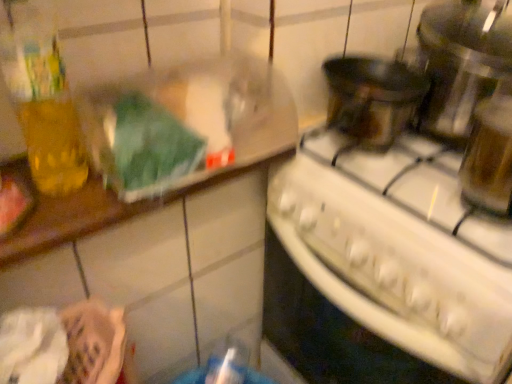
In order to face white glossy stove at center, should I rotate leftwards or rightwards?

You should rotate right by 19.127 degrees.

Measure the distance between white glossy stove at center and camera.

The depth of white glossy stove at center is 54.33 centimeters.

The image size is (512, 384). Describe the element at coordinates (383, 270) in the screenshot. I see `white glossy stove at center` at that location.

Locate an element on the screen. The image size is (512, 384). white glossy stove at center is located at coordinates (383, 270).

Identify the location of metallic silver pot at upper right. The image size is (512, 384). coord(460,64).

The width and height of the screenshot is (512, 384). What do you see at coordinates (460, 64) in the screenshot?
I see `metallic silver pot at upper right` at bounding box center [460, 64].

Where is `white glossy stove at center`? The image size is (512, 384). white glossy stove at center is located at coordinates (383, 270).

Considering the relative positions of white glossy stove at center and metallic silver pot at upper right in the image provided, is white glossy stove at center to the left of metallic silver pot at upper right from the viewer's perspective?

Yes, white glossy stove at center is to the left of metallic silver pot at upper right.

Considering the relative positions of white glossy stove at center and metallic silver pot at upper right in the image provided, is white glossy stove at center behind metallic silver pot at upper right?

No.

Does point (446, 312) come in front of point (466, 4)?

Yes, it is in front of point (466, 4).

In the scene shown: From the image's perspective, is white glossy stove at center on top of metallic silver pot at upper right?

No, from the image's perspective, white glossy stove at center is not on top of metallic silver pot at upper right.

From a real-world perspective, is white glossy stove at center under metallic silver pot at upper right?

Yes, from a real-world perspective, white glossy stove at center is below metallic silver pot at upper right.

Which object is thinner, white glossy stove at center or metallic silver pot at upper right?

With smaller width is metallic silver pot at upper right.

Based on the photo, is white glossy stove at center taller or shorter than metallic silver pot at upper right?

In the image, white glossy stove at center appears to be taller than metallic silver pot at upper right.

Is white glossy stove at center smaller than metallic silver pot at upper right?

No, white glossy stove at center is not smaller than metallic silver pot at upper right.

Is white glossy stove at center surrounding metallic silver pot at upper right?

Actually, metallic silver pot at upper right is outside white glossy stove at center.

Is white glossy stove at center far from metallic silver pot at upper right?

No, white glossy stove at center is in close proximity to metallic silver pot at upper right.

From the picture: Could you tell me if white glossy stove at center is turned towards metallic silver pot at upper right?

No, white glossy stove at center is not turned towards metallic silver pot at upper right.

Measure the distance between white glossy stove at center and metallic silver pot at upper right.

The distance of white glossy stove at center from metallic silver pot at upper right is 11.58 inches.

Identify the location of appliance that appears behind the white glossy stove at center. (460, 64).

In the image, is metallic silver pot at upper right on the left side or the right side of white glossy stove at center?

In the image, metallic silver pot at upper right appears on the right side of white glossy stove at center.

Is metallic silver pot at upper right in front of or behind white glossy stove at center in the image?

metallic silver pot at upper right is positioned farther from the viewer than white glossy stove at center.

Which is closer, (488, 91) or (473, 287)?

Point (488, 91) appears to be farther away from the viewer than point (473, 287).

From the image's perspective, is metallic silver pot at upper right beneath white glossy stove at center?

No.

Consider the image. From a real-world perspective, is metallic silver pot at upper right physically above white glossy stove at center?

Yes, from a real-world perspective, metallic silver pot at upper right is on top of white glossy stove at center.

Which of these two, metallic silver pot at upper right or white glossy stove at center, is thinner?

Thinner between the two is metallic silver pot at upper right.

Which of these two, metallic silver pot at upper right or white glossy stove at center, stands taller?

white glossy stove at center is taller.

Considering the sizes of objects metallic silver pot at upper right and white glossy stove at center in the image provided, who is smaller, metallic silver pot at upper right or white glossy stove at center?

metallic silver pot at upper right.

Is metallic silver pot at upper right situated inside white glossy stove at center or outside?

metallic silver pot at upper right is outside white glossy stove at center.

Is metallic silver pot at upper right with white glossy stove at center?

metallic silver pot at upper right and white glossy stove at center are clearly separated.

Is metallic silver pot at upper right aimed at white glossy stove at center?

No.

What's the angular difference between metallic silver pot at upper right and white glossy stove at center's facing directions?

The facing directions of metallic silver pot at upper right and white glossy stove at center are 1.26 degrees apart.

This screenshot has width=512, height=384. In order to click on kitchen appliance below the metallic silver pot at upper right (from a real-world perspective) in this screenshot , I will do `click(383, 270)`.

Identify the location of appliance behind the white glossy stove at center. (460, 64).

You are a GUI agent. You are given a task and a screenshot of the screen. Output one action in this format:
    pyautogui.click(x=<x>, y=<y>)
    Task: Click on the appliance that appears above the white glossy stove at center (from the image's perspective)
    This screenshot has height=384, width=512.
    Given the screenshot: What is the action you would take?
    pyautogui.click(x=460, y=64)